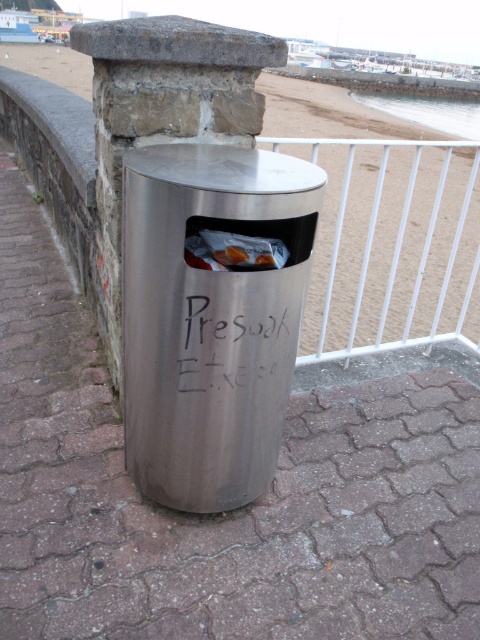
You are a city planner reviewing the placement of the black matte graffiti at center. According to the coordinates provided, is the graffiti closer to the edge of the walkway or the center of the walkway?

The black matte graffiti at center is located at point coordinates (237, 342), which places it closer to the center of the walkway rather than the edge.

You are a beach cleaner and you need to place a new translucent plastic bag at center into the silver metallic trash can at center. Can the bag fit inside the trash can based on their widths?

The silver metallic trash can at center is wider than the translucent plastic bag at center, so the bag can fit inside the trash can.

You are standing on the walkway near the beach and see two points marked on the ground. The first point is at coordinate point [408,310] and the second is at point [252,353]. If you are facing the beach, which point is closer to the stone wall behind you?

Point [408,310] is behind point [252,353], so the first point is closer to the stone wall behind you.